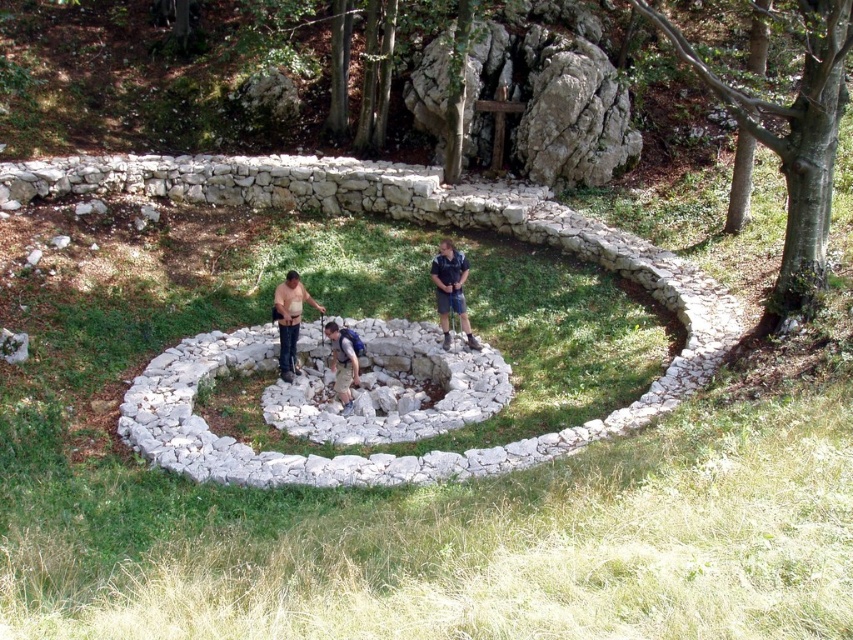
Question: Which point is closer to the camera?

Choices:
 (A) light brown leather shirt at center
 (B) denim shorts at center

Answer: (B)

Question: Is light brown leather shirt at center smaller than denim shorts at center?

Choices:
 (A) no
 (B) yes

Answer: (A)

Question: Is light brown leather shirt at center closer to the viewer compared to denim shorts at center?

Choices:
 (A) no
 (B) yes

Answer: (A)

Question: Which object appears farthest from the camera in this image?

Choices:
 (A) denim shorts at center
 (B) light brown leather shirt at center

Answer: (B)

Question: Is blue denim shirt at center below light brown leather shirt at center?

Choices:
 (A) no
 (B) yes

Answer: (A)

Question: Which of the following is the closest to the observer?

Choices:
 (A) denim shorts at center
 (B) light brown leather shirt at center

Answer: (A)